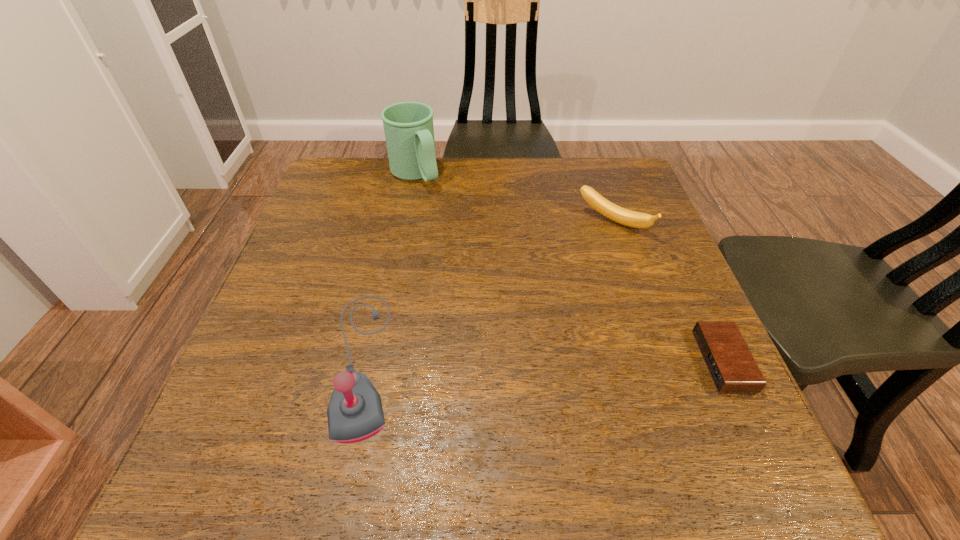
Identify the location of free space on the desktop that is between the joystick and the alarm clock and is positioned on the side of the tallest object with the handle. This screenshot has height=540, width=960. (576, 361).

Where is `vacant space on the desktop that is between the third shortest object and the shortest object and is positioned at the stem of the second farthest object`? This screenshot has width=960, height=540. vacant space on the desktop that is between the third shortest object and the shortest object and is positioned at the stem of the second farthest object is located at coordinates (511, 361).